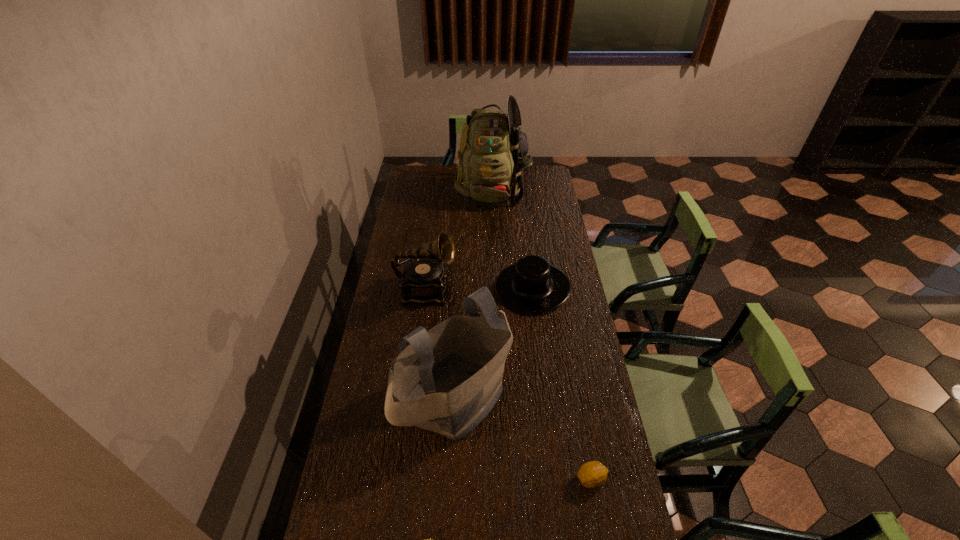
At what (x,y) coordinates should I click in order to perform the action: click on free space located on the left of the fourth tallest object. Please return your answer as a coordinate pair (x, y). This screenshot has height=540, width=960. Looking at the image, I should click on click(475, 287).

You are a GUI agent. You are given a task and a screenshot of the screen. Output one action in this format:
    pyautogui.click(x=<x>, y=<y>)
    Task: Click on the free space located 0.300m at the stem end of the fifth farthest object
    Image resolution: width=960 pixels, height=540 pixels.
    Given the screenshot: What is the action you would take?
    pyautogui.click(x=470, y=479)

Where is `free space located 0.380m at the stem end of the fifth farthest object`? free space located 0.380m at the stem end of the fifth farthest object is located at coordinates (x=443, y=479).

At what (x,y) coordinates should I click in order to perform the action: click on free space located at the stem end of the fifth farthest object. Please return your answer as a coordinate pair (x, y). Looking at the image, I should click on (543, 479).

Where is `object that is at the far edge`? This screenshot has height=540, width=960. object that is at the far edge is located at coordinates (493, 151).

Find the location of `shopping bag that is at the left edge`. shopping bag that is at the left edge is located at coordinates (449, 378).

Where is `phonograph record that is at the left edge`? phonograph record that is at the left edge is located at coordinates (424, 279).

Find the location of a particular element. backpack present at the right edge is located at coordinates (493, 151).

I want to click on dress hat that is at the right edge, so click(532, 285).

The image size is (960, 540). Identify the location of lemon that is at the right edge. (592, 474).